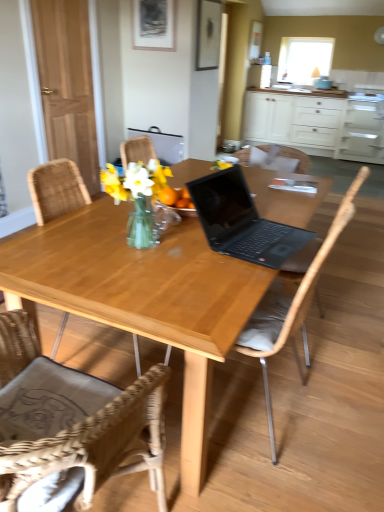
Question: Is matte white armchair at upper center at the right side of wooden chair at center, which is the first chair in back-to-front order?

Choices:
 (A) no
 (B) yes

Answer: (A)

Question: Is matte white armchair at upper center oriented away from wooden chair at center, which is the third chair from front to back?

Choices:
 (A) yes
 (B) no

Answer: (B)

Question: From a real-world perspective, is matte white armchair at upper center physically above wooden chair at center, which is the first chair in back-to-front order?

Choices:
 (A) no
 (B) yes

Answer: (A)

Question: From the image's perspective, is matte white armchair at upper center over wooden chair at center, which is the third chair from front to back?

Choices:
 (A) no
 (B) yes

Answer: (B)

Question: Does matte white armchair at upper center come behind wooden chair at center, which is the first chair in back-to-front order?

Choices:
 (A) yes
 (B) no

Answer: (A)

Question: Can you confirm if matte white armchair at upper center is taller than wooden chair at center, which is the first chair in back-to-front order?

Choices:
 (A) no
 (B) yes

Answer: (B)

Question: Does matte black picture frame at upper center, which is the first picture frame in left-to-right order, have a larger size compared to matte white armchair at upper center?

Choices:
 (A) yes
 (B) no

Answer: (B)

Question: From a real-world perspective, is matte black picture frame at upper center, which is the first picture frame in left-to-right order, on top of matte white armchair at upper center?

Choices:
 (A) no
 (B) yes

Answer: (B)

Question: Does matte black picture frame at upper center, which appears as the second picture frame when viewed from the right, come behind matte white armchair at upper center?

Choices:
 (A) no
 (B) yes

Answer: (A)

Question: Does matte black picture frame at upper center, which appears as the second picture frame when viewed from the right, appear on the left side of matte white armchair at upper center?

Choices:
 (A) yes
 (B) no

Answer: (B)

Question: Is matte black picture frame at upper center, which appears as the second picture frame when viewed from the right, outside of matte white armchair at upper center?

Choices:
 (A) yes
 (B) no

Answer: (A)

Question: Is matte black picture frame at upper center, which appears as the second picture frame when viewed from the right, closer to the viewer compared to matte white armchair at upper center?

Choices:
 (A) yes
 (B) no

Answer: (A)

Question: Is transparent glass window screen at upper center at the back of wooden chair at center, which is counted as the 2th chair, starting from the back?

Choices:
 (A) no
 (B) yes

Answer: (A)